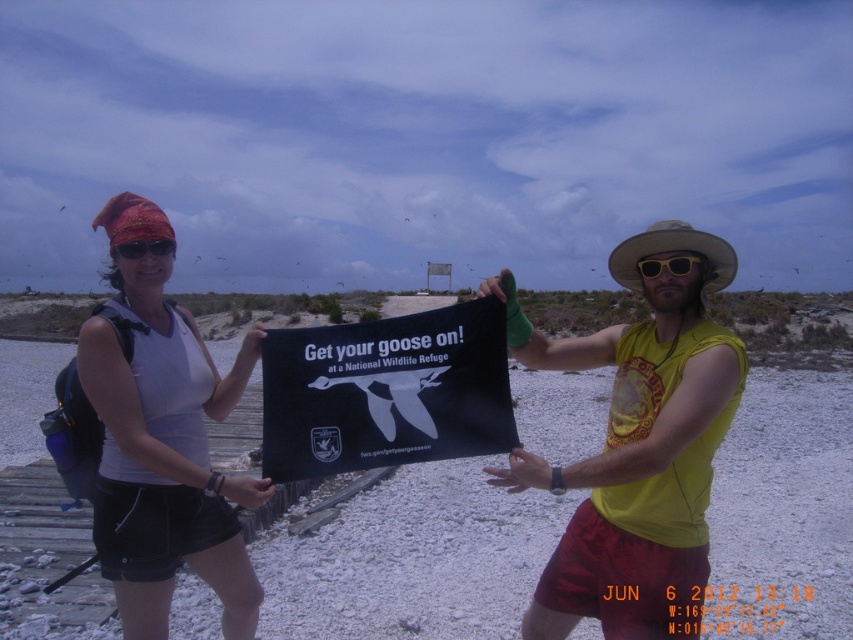
Question: Can you confirm if yellow sleeveless shirt at center is positioned to the left of red fabric bandana at upper left?

Choices:
 (A) yes
 (B) no

Answer: (B)

Question: Is white fabric at center above yellow plastic goggles at center?

Choices:
 (A) no
 (B) yes

Answer: (A)

Question: Based on their relative distances, which object is nearer to the black fabric sign at center?

Choices:
 (A) red fabric bandana at upper left
 (B) yellow plastic goggles at center

Answer: (B)

Question: Does yellow sleeveless shirt at center appear under white fabric at center?

Choices:
 (A) yes
 (B) no

Answer: (B)

Question: Which object is the closest to the yellow plastic goggles at center?

Choices:
 (A) white fabric at center
 (B) red fabric bandana at upper left
 (C) yellow sleeveless shirt at center
 (D) black fabric sign at center

Answer: (C)

Question: Which object is closer to the camera taking this photo?

Choices:
 (A) yellow sleeveless shirt at center
 (B) yellow plastic goggles at center
 (C) white fabric at center

Answer: (B)